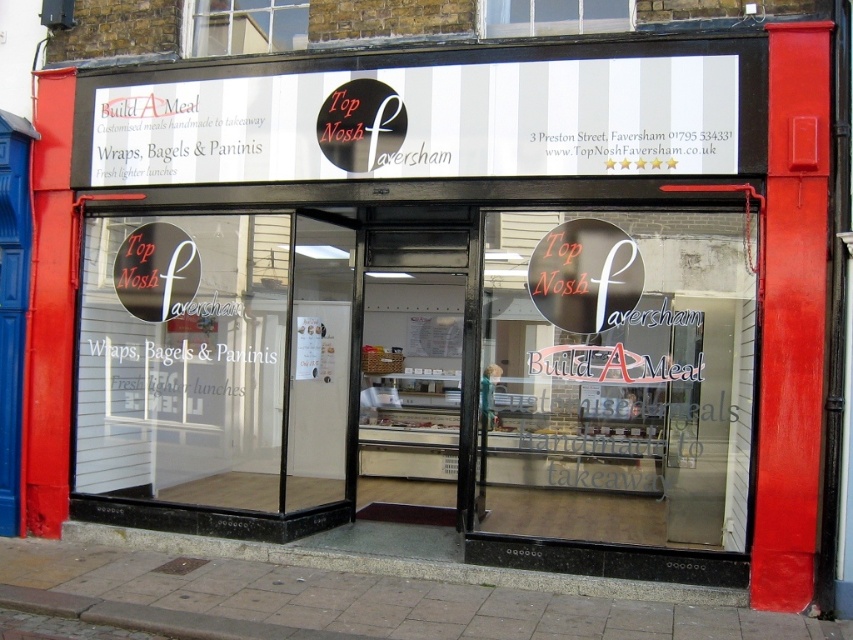
You are a delivery person standing at the entrance of Top Nosh Faversham. You need to place a package on a shelf that is exactly 2 meters away from the entrance. The clear glass window at upper center and the white glass window at upper center are both in your line of sight. Which window should you use as a reference to ensure the package is placed correctly?

The distance between the clear glass window at upper center and the white glass window at upper center is 1.88 meters. Since the shelf needs to be 2 meters away from the entrance, neither window is exactly 2 meters away. However, if you position the package so it is 1.12 meters beyond the farther window from the entrance, it would reach the 2 meter mark.

You are a customer approaching the entrance of Top Nosh Faversham. You see the transparent glass door at center and the clear glass window at upper center. Which object is located to the right of the other?

The transparent glass door at center is to the right of the clear glass window at upper center.